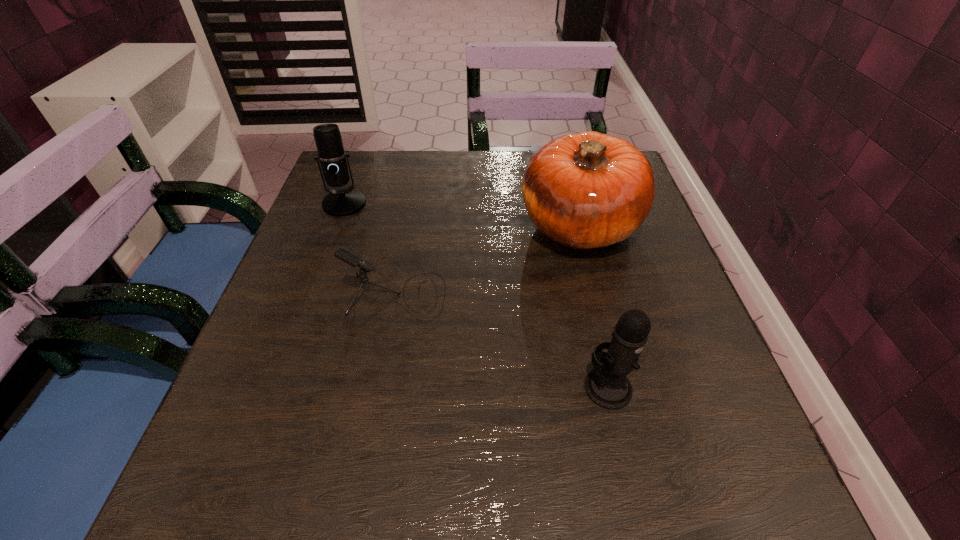
Where is `pumpkin`? The width and height of the screenshot is (960, 540). pumpkin is located at coordinates (587, 190).

Locate an element on the screen. The height and width of the screenshot is (540, 960). the leftmost object is located at coordinates (332, 164).

The image size is (960, 540). Find the location of `the leftmost microphone`. the leftmost microphone is located at coordinates (332, 164).

This screenshot has height=540, width=960. I want to click on the nearest object, so click(606, 385).

Where is `the rightmost microphone`? This screenshot has height=540, width=960. the rightmost microphone is located at coordinates (606, 385).

Find the location of `the shortest microphone`. the shortest microphone is located at coordinates (345, 255).

The height and width of the screenshot is (540, 960). I want to click on the second farthest microphone, so click(345, 255).

The image size is (960, 540). I want to click on free region located on the left of the pumpkin, so click(392, 226).

Find the location of `vacant area located on the front of the leftmost microphone`. vacant area located on the front of the leftmost microphone is located at coordinates (313, 288).

You are a GUI agent. You are given a task and a screenshot of the screen. Output one action in this format:
    pyautogui.click(x=<x>, y=<y>)
    Task: Click on the vacant space situated 0.130m on the left of the rightmost microphone
    
    Given the screenshot: What is the action you would take?
    pyautogui.click(x=504, y=387)